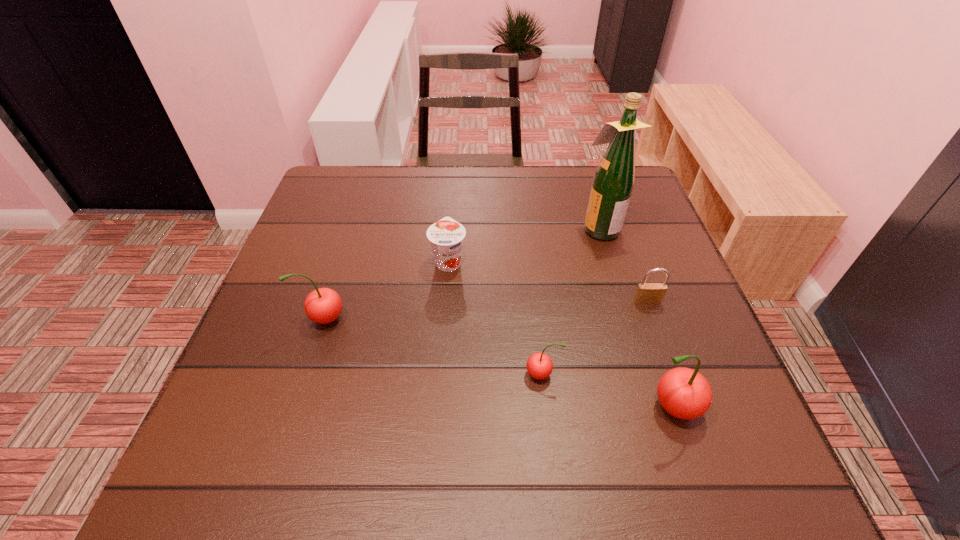
Locate an element on the screen. object situated at the left edge is located at coordinates (323, 305).

The height and width of the screenshot is (540, 960). I want to click on cherry present at the right edge, so click(x=684, y=393).

Identify the location of padlock that is at the right edge. (647, 293).

Find the location of `liquor at the right edge`. liquor at the right edge is located at coordinates (613, 182).

Image resolution: width=960 pixels, height=540 pixels. What are the coordinates of `object located in the far right corner section of the desktop` in the screenshot? It's located at (613, 182).

This screenshot has width=960, height=540. What are the coordinates of `object located at the near right corner` in the screenshot? It's located at (684, 393).

The height and width of the screenshot is (540, 960). In the image, there is a desktop. In order to click on free region at the far edge in this screenshot , I will do `click(438, 195)`.

Locate an element on the screen. The image size is (960, 540). vacant point at the near edge is located at coordinates (571, 407).

In the image, there is a desktop. Identify the location of free space at the left edge. (330, 276).

You are a GUI agent. You are given a task and a screenshot of the screen. Output one action in this format:
    pyautogui.click(x=<x>, y=<y>)
    Task: Click on the vacant position at the right edge of the desktop
    
    Given the screenshot: What is the action you would take?
    pyautogui.click(x=611, y=258)